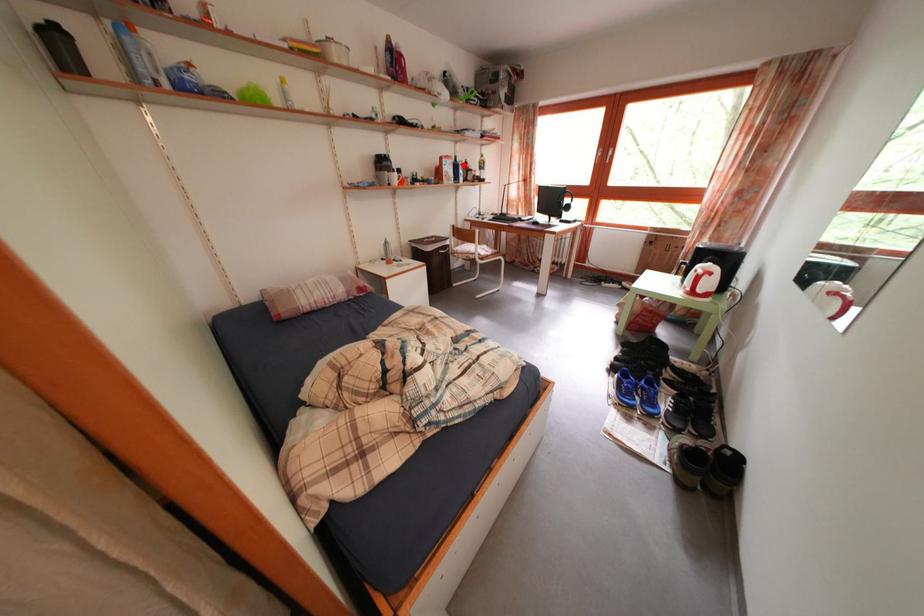
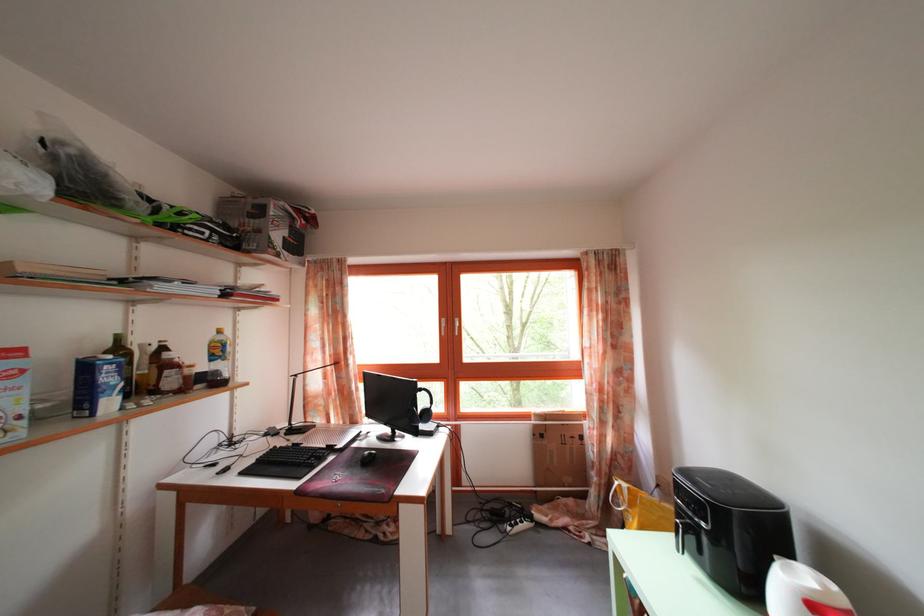
Question: I am providing you with two images of the same scene from different viewpoints. Given a red point in image1, look at the same physical point in image2. Is it:

Choices:
 (A) Closer to the viewpoint
 (B) Farther from the viewpoint

Answer: (B)